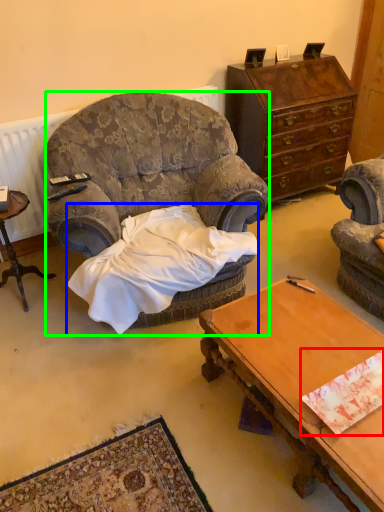
Question: Estimate the real-world distances between objects in this image. Which object is closer to sheet (highlighted by a red box), blanket (highlighted by a blue box) or chair (highlighted by a green box)?

Choices:
 (A) blanket
 (B) chair

Answer: (A)